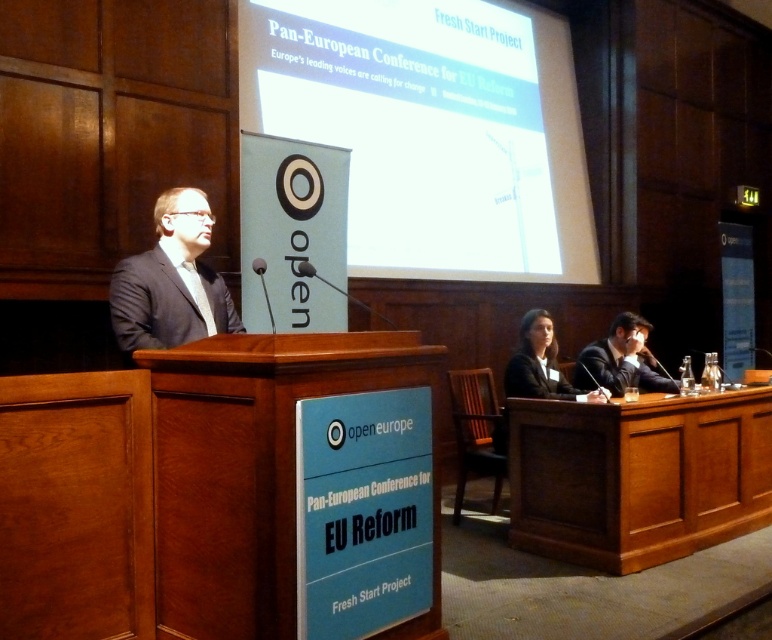
You are standing in the conference room and want to approach the white glossy projection screen at upper center. If your walking speed is 1.2 meters per second, how many seconds will it take you to reach the screen?

The distance between you and the white glossy projection screen at upper center is 4.34 meters. At a speed of 1.2 meters per second, it will take approximately 3.6 seconds to reach the screen.

You are attending the Pan European Conference for EU Reform and you are standing at the entrance of the conference hall. You see two points marked in the scene. The first point is at coordinate point(412, 49) and the second point is at coordinate point(640, 552). Which point is closer to you?

Point(412, 49) is closer to you because it is further to the viewer than point(640, 552).

You are a photographer standing at the back of the conference room. You need to take a photo of the black matte suit at lower right and the large screen at the back. Since the distance between them is 4.08 meters, will you be able to capture both subjects in a single frame without moving the camera?

The distance between the black matte suit at lower right and the large screen at the back is 4.08 meters. Whether they can be captured in a single frame depends on the camera lens used. A wide angle lens with a focal length of 24mm or lower can cover this distance, allowing both subjects to be in the same frame without moving the camera.